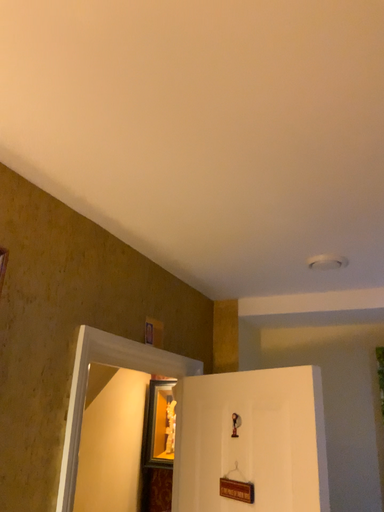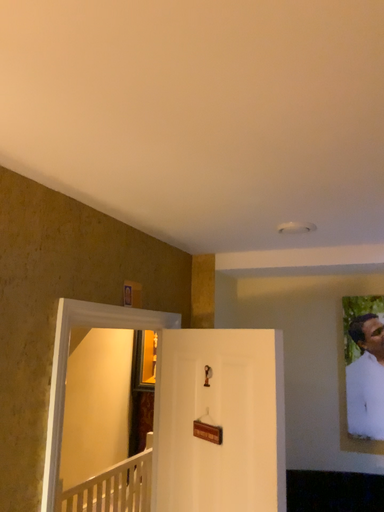
Question: Which way did the camera rotate in the video?

Choices:
 (A) rotated downward
 (B) rotated upward

Answer: (A)